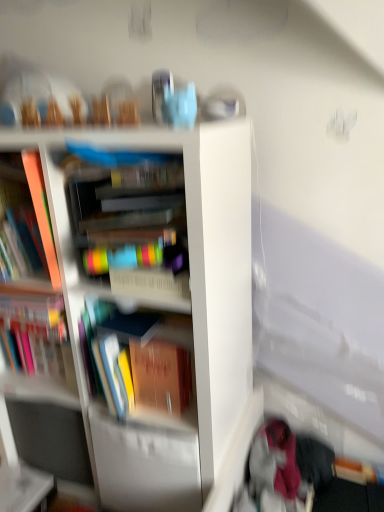
Identify the location of free spot above white glossy table at lower left (from a real-world perspective). The image size is (384, 512). (15, 484).